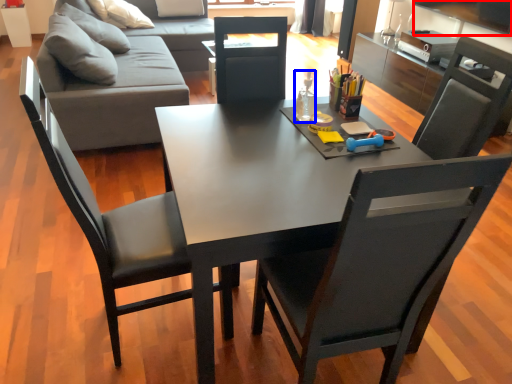
Question: Which object appears closest to the camera in this image, television (highlighted by a red box) or bottle (highlighted by a blue box)?

Choices:
 (A) television
 (B) bottle

Answer: (B)